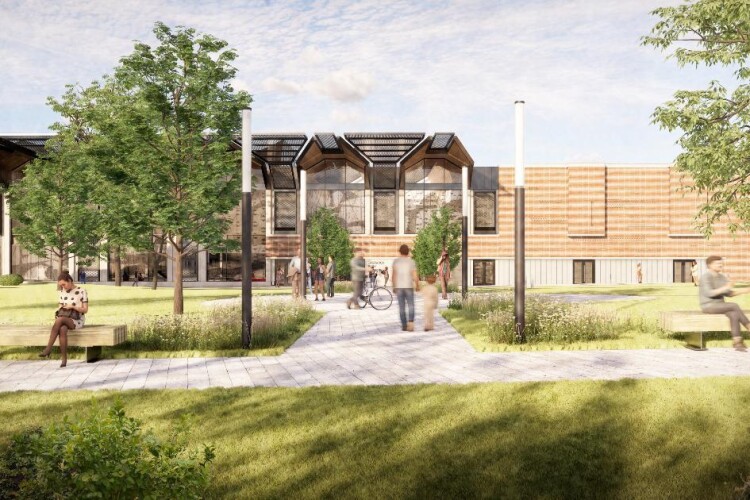
Where is `space to sit`? space to sit is located at coordinates (22, 328).